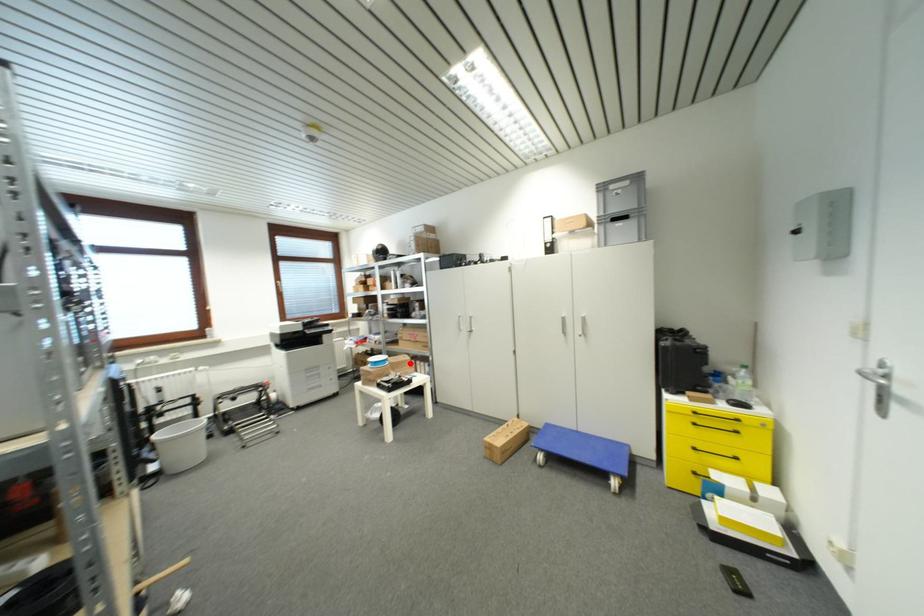
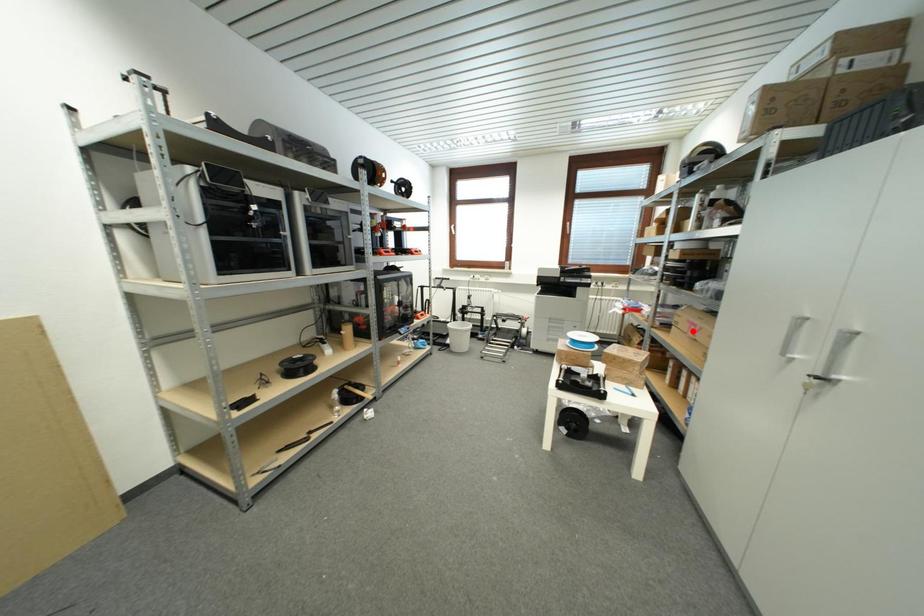
I am providing you with two images of the same scene from different viewpoints. A red point is marked on the first image and another point is marked on the second image. Are the points marked in image1 and image2 representing the same 3D position?

No